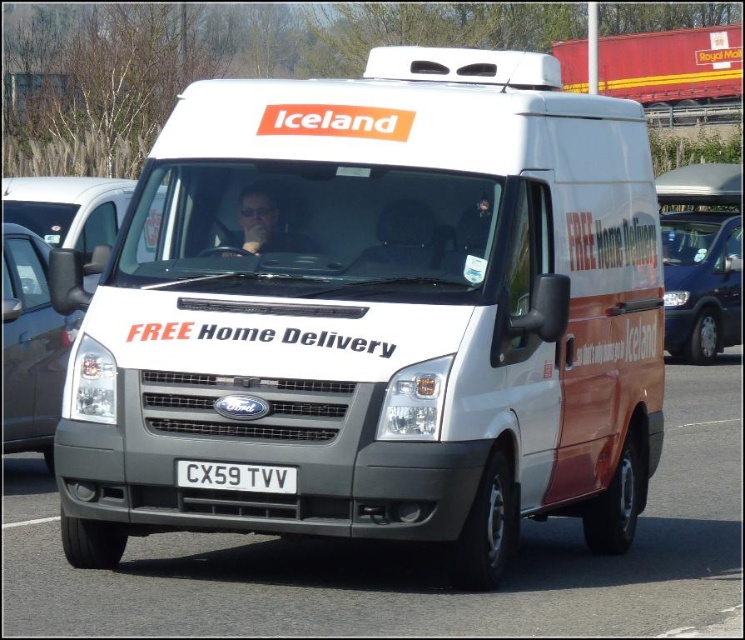
Based on the photo, you are a delivery person who needs to confirm the license plate number of the van. Since you are standing in front of the satin black van at left, can you easily see the white plastic license plate at center?

The satin black van at left is further to the viewer than the white plastic license plate at center, so yes, you can easily see the white plastic license plate at center because it is closer to you.